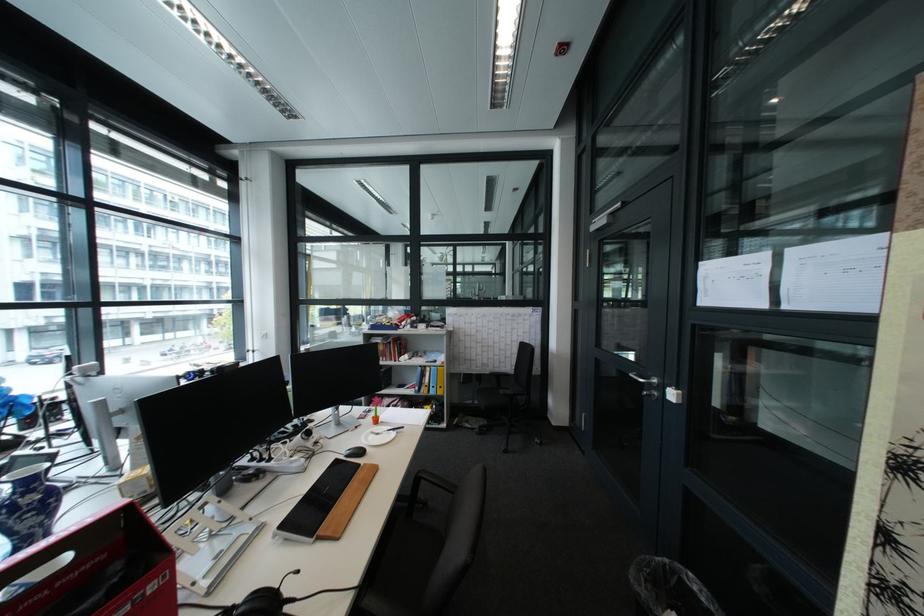
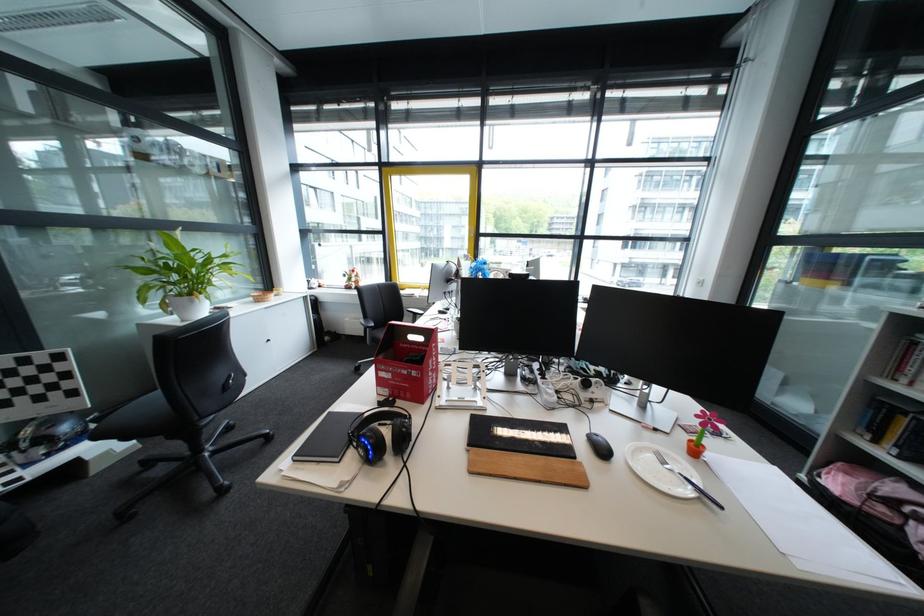
Find the pixel in the second image that matches point 410,434 in the first image.

(712, 501)